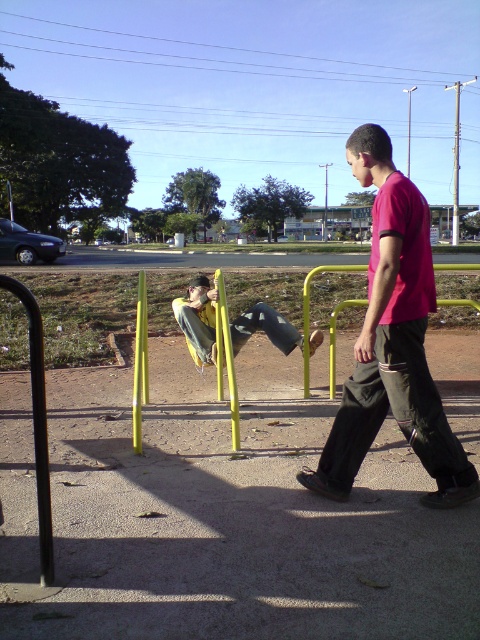
Can you confirm if pink matte shirt at center is smaller than yellow fabric pants at center?

Incorrect, pink matte shirt at center is not smaller in size than yellow fabric pants at center.

Find the location of a particular element. The image size is (480, 640). pink matte shirt at center is located at coordinates (393, 342).